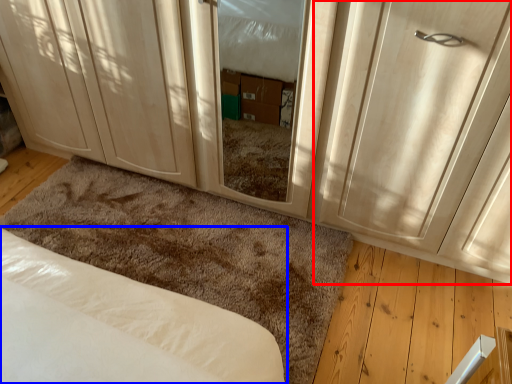
Question: Which object appears closest to the camera in this image, door (highlighted by a red box) or bed (highlighted by a blue box)?

Choices:
 (A) door
 (B) bed

Answer: (A)